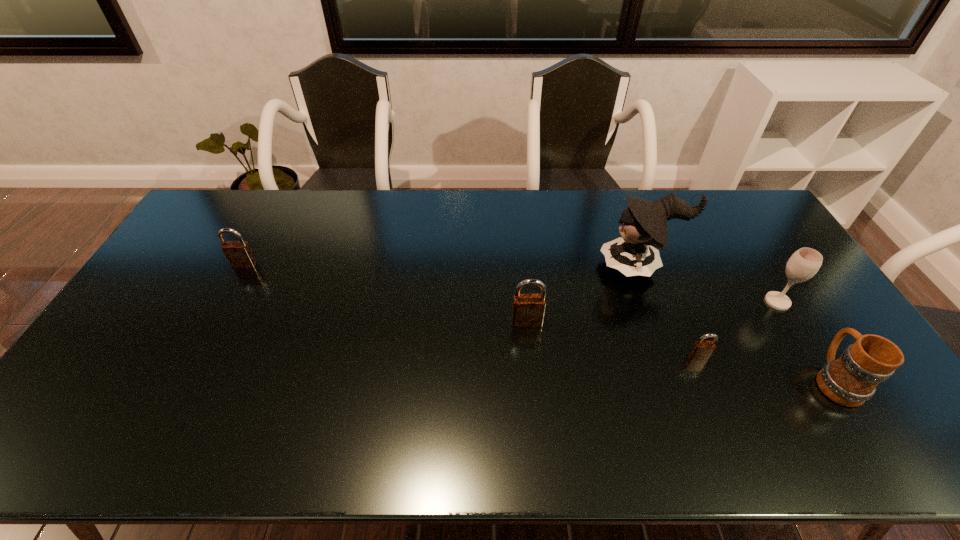
Locate an element on the screen. The height and width of the screenshot is (540, 960). free space located on the front-facing side of the second farthest padlock is located at coordinates (529, 345).

At what (x,y) coordinates should I click in order to perform the action: click on free region located 0.130m on the front-facing side of the shortest padlock. Please return your answer as a coordinate pair (x, y). Looking at the image, I should click on (718, 405).

Find the location of `free space located 0.380m on the left of the wineglass`. free space located 0.380m on the left of the wineglass is located at coordinates coord(638,301).

Locate an element on the screen. The height and width of the screenshot is (540, 960). vacant space located 0.190m at the face of the doll is located at coordinates (540, 266).

Where is `vacant area situated at the face of the doll`? The width and height of the screenshot is (960, 540). vacant area situated at the face of the doll is located at coordinates (568, 266).

Image resolution: width=960 pixels, height=540 pixels. I want to click on vacant space located 0.270m at the face of the doll, so click(x=516, y=266).

The height and width of the screenshot is (540, 960). Identify the location of free space located on the side of the mug with the handle. [768, 275].

The image size is (960, 540). I want to click on vacant space located on the side of the mug with the handle, so click(759, 262).

The height and width of the screenshot is (540, 960). In order to click on blank space located 0.070m on the side of the mug with the handle in this screenshot , I will do `click(805, 334)`.

Identify the location of object positioned at the near edge. This screenshot has height=540, width=960. (852, 379).